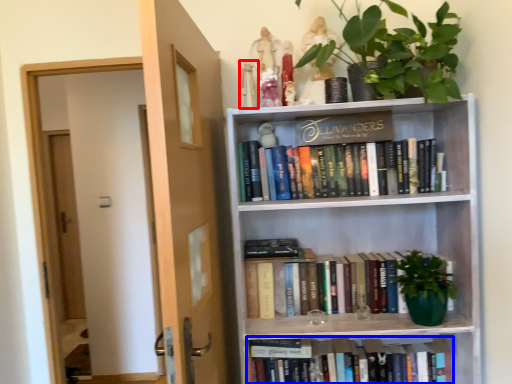
Question: Which of the following is the closest to the observer, toy (highlighted by a red box) or book (highlighted by a blue box)?

Choices:
 (A) toy
 (B) book

Answer: (A)